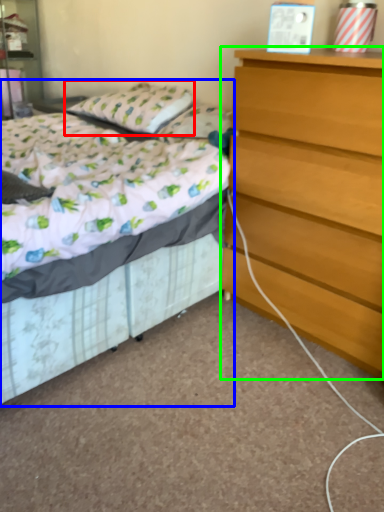
Question: Based on their relative distances, which object is nearer to pillow (highlighted by a red box)? Choose from bed (highlighted by a blue box) and chest of drawers (highlighted by a green box).

Choices:
 (A) bed
 (B) chest of drawers

Answer: (A)